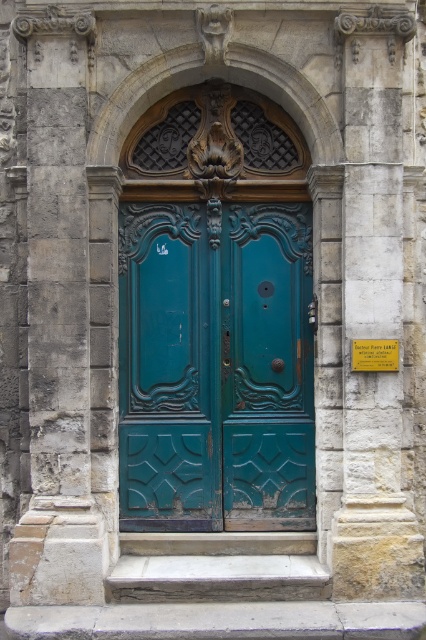
Question: Does teal carved wood door at center appear on the left side of stone textured pillar at right?

Choices:
 (A) yes
 (B) no

Answer: (A)

Question: Among these objects, which one is nearest to the camera?

Choices:
 (A) stone textured pillar at right
 (B) teal carved wood door at center

Answer: (A)

Question: Can you confirm if teal carved wood door at center is thinner than stone textured pillar at right?

Choices:
 (A) no
 (B) yes

Answer: (A)

Question: Can you confirm if teal carved wood door at center is positioned to the left of stone textured pillar at right?

Choices:
 (A) no
 (B) yes

Answer: (B)